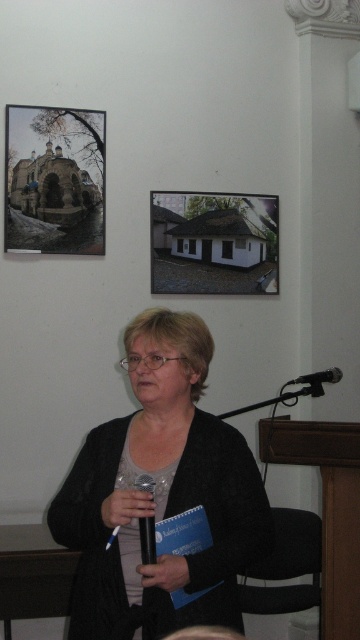
Which of these two, black matte cardigan at center or white matte house at upper center, stands taller?

With more height is black matte cardigan at center.

Between point (268, 550) and point (248, 252), which one is positioned in front?

Point (268, 550) is in front.

Between point (225, 476) and point (228, 250), which one is positioned behind?

Point (228, 250)

In order to click on black matte cardigan at center in this screenshot , I will do `click(160, 493)`.

Is black matte cardigan at center taller than black metallic microphone at center?

Indeed, black matte cardigan at center has a greater height compared to black metallic microphone at center.

Is point (160, 316) positioned behind point (149, 483)?

Yes, it is.

Find the location of a particular element. black matte cardigan at center is located at coordinates (160, 493).

Which is above, black metallic microphone at center or black metallic microphone at lower right?

black metallic microphone at lower right is higher up.

Does black metallic microphone at center appear over black metallic microphone at lower right?

No, black metallic microphone at center is not above black metallic microphone at lower right.

Find the location of `black metallic microphone at center`. black metallic microphone at center is located at coordinates (146, 540).

You are a GUI agent. You are given a task and a screenshot of the screen. Output one action in this format:
    pyautogui.click(x=<x>, y=<y>)
    Task: Click on the black metallic microphone at center
    Image resolution: width=360 pixels, height=640 pixels.
    Given the screenshot: What is the action you would take?
    pyautogui.click(x=146, y=540)